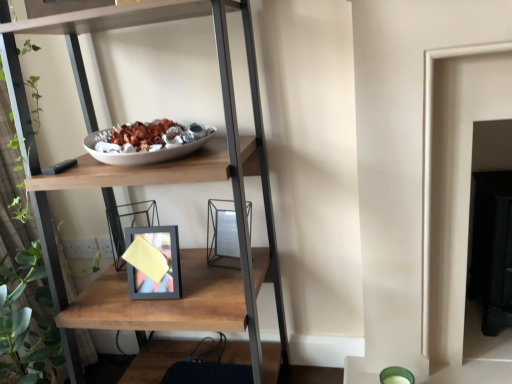
What do you see at coordinates (222, 235) in the screenshot? I see `metallic silver picture frame at center` at bounding box center [222, 235].

This screenshot has width=512, height=384. In order to click on metallic silver picture frame at center in this screenshot , I will do `click(222, 235)`.

Measure the distance between wooden shelf at center and camera.

wooden shelf at center and camera are 95.24 centimeters apart from each other.

What do you see at coordinates (195, 153) in the screenshot?
I see `wooden shelf at center` at bounding box center [195, 153].

Measure the distance between point [262,130] and camera.

The distance of point [262,130] from camera is 1.34 meters.

Locate an element on the screen. This screenshot has height=384, width=512. wooden shelf at center is located at coordinates (195, 153).

At what (x,y) coordinates should I click in order to perform the action: click on metallic silver picture frame at center. Please return your answer as a coordinate pair (x, y). Image resolution: width=512 pixels, height=384 pixels. Looking at the image, I should click on (222, 235).

Is wooden shelf at center at the left side of metallic silver picture frame at center?

Correct, you'll find wooden shelf at center to the left of metallic silver picture frame at center.

Is the depth of wooden shelf at center less than that of metallic silver picture frame at center?

That is True.

Which is in front, point (247, 269) or point (249, 232)?

Point (247, 269)

From the image's perspective, between wooden shelf at center and metallic silver picture frame at center, which one is located above?

wooden shelf at center.

From a real-world perspective, is wooden shelf at center physically located above or below metallic silver picture frame at center?

In terms of real-world spatial position, wooden shelf at center is above metallic silver picture frame at center.

Looking at their sizes, would you say wooden shelf at center is wider or thinner than metallic silver picture frame at center?

Considering their sizes, wooden shelf at center looks broader than metallic silver picture frame at center.

Consider the image. Is wooden shelf at center shorter than metallic silver picture frame at center?

Incorrect, the height of wooden shelf at center does not fall short of that of metallic silver picture frame at center.

Between wooden shelf at center and metallic silver picture frame at center, which one has smaller size?

metallic silver picture frame at center is smaller.

Is wooden shelf at center situated inside metallic silver picture frame at center or outside?

wooden shelf at center is outside metallic silver picture frame at center.

Is there a large distance between wooden shelf at center and metallic silver picture frame at center?

No, wooden shelf at center is not far away from metallic silver picture frame at center.

Is wooden shelf at center looking in the opposite direction of metallic silver picture frame at center?

Yes, wooden shelf at center's orientation is away from metallic silver picture frame at center.

How different are the orientations of wooden shelf at center and metallic silver picture frame at center in degrees?

15.2 degrees separate the facing orientations of wooden shelf at center and metallic silver picture frame at center.

How far apart are wooden shelf at center and metallic silver picture frame at center?

A distance of 11.42 inches exists between wooden shelf at center and metallic silver picture frame at center.

The image size is (512, 384). In order to click on picture frame on the right side of wooden shelf at center in this screenshot , I will do `click(222, 235)`.

Which is more to the right, metallic silver picture frame at center or wooden shelf at center?

metallic silver picture frame at center.

Does metallic silver picture frame at center come in front of wooden shelf at center?

No.

Considering the positions of point (212, 204) and point (98, 22), is point (212, 204) closer or farther from the camera than point (98, 22)?

Point (212, 204) is positioned farther from the camera compared to point (98, 22).

From the image's perspective, would you say metallic silver picture frame at center is shown under wooden shelf at center?

Indeed, from the image's perspective, metallic silver picture frame at center is shown beneath wooden shelf at center.

From a real-world perspective, is metallic silver picture frame at center located higher than wooden shelf at center?

No.

Considering the sizes of objects metallic silver picture frame at center and wooden shelf at center in the image provided, who is thinner, metallic silver picture frame at center or wooden shelf at center?

metallic silver picture frame at center is thinner.

Who is shorter, metallic silver picture frame at center or wooden shelf at center?

metallic silver picture frame at center.

Based on the photo, between metallic silver picture frame at center and wooden shelf at center, which one has larger size?

wooden shelf at center.

Can wooden shelf at center be found inside metallic silver picture frame at center?

Actually, wooden shelf at center is outside metallic silver picture frame at center.

Is metallic silver picture frame at center next to wooden shelf at center and touching it?

No, metallic silver picture frame at center is not beside wooden shelf at center.

Is metallic silver picture frame at center facing away from wooden shelf at center?

That's right, metallic silver picture frame at center is facing away from wooden shelf at center.

Identify the location of shelf above the metallic silver picture frame at center (from a real-world perspective). pos(195,153).

What are the coordinates of `picture frame beneath the wooden shelf at center (from a real-world perspective)` in the screenshot? It's located at (222, 235).

Identify the location of shelf to the left of metallic silver picture frame at center. The image size is (512, 384). (195, 153).